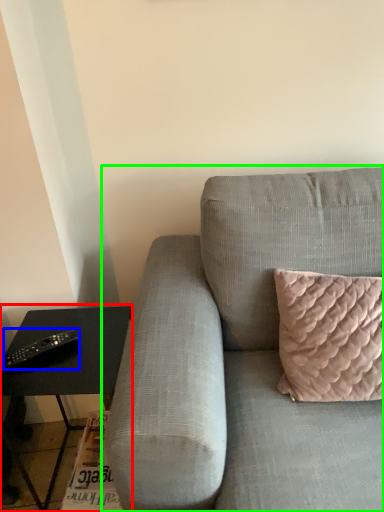
Question: Estimate the real-world distances between objects in this image. Which object is farther from table (highlighted by a red box), remote (highlighted by a blue box) or studio couch (highlighted by a green box)?

Choices:
 (A) remote
 (B) studio couch

Answer: (B)